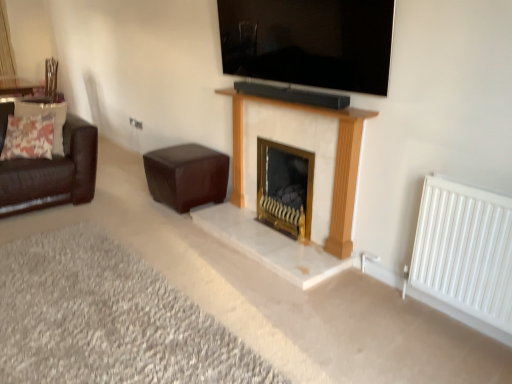
Question: From a real-world perspective, is white fabric curtain at upper left on white metal radiator at right?

Choices:
 (A) no
 (B) yes

Answer: (B)

Question: Does white fabric curtain at upper left have a lesser height compared to white metal radiator at right?

Choices:
 (A) yes
 (B) no

Answer: (B)

Question: Can you confirm if white fabric curtain at upper left is thinner than white metal radiator at right?

Choices:
 (A) yes
 (B) no

Answer: (B)

Question: Does white fabric curtain at upper left touch white metal radiator at right?

Choices:
 (A) no
 (B) yes

Answer: (A)

Question: From the image's perspective, is white fabric curtain at upper left beneath white metal radiator at right?

Choices:
 (A) no
 (B) yes

Answer: (A)

Question: Considering their positions, is white marble fireplace at center located in front of or behind white shaggy carpet at lower left?

Choices:
 (A) front
 (B) behind

Answer: (B)

Question: Is white marble fireplace at center to the left or to the right of white shaggy carpet at lower left in the image?

Choices:
 (A) left
 (B) right

Answer: (B)

Question: Is white marble fireplace at center bigger or smaller than white shaggy carpet at lower left?

Choices:
 (A) big
 (B) small

Answer: (B)

Question: From a real-world perspective, is white marble fireplace at center positioned above or below white shaggy carpet at lower left?

Choices:
 (A) above
 (B) below

Answer: (A)

Question: From the image's perspective, is white metal radiator at right positioned above or below white marble fireplace at center?

Choices:
 (A) above
 (B) below

Answer: (B)

Question: Is point (476, 233) closer or farther from the camera than point (293, 155)?

Choices:
 (A) closer
 (B) farther

Answer: (A)

Question: Based on their sizes in the image, would you say white metal radiator at right is bigger or smaller than white marble fireplace at center?

Choices:
 (A) big
 (B) small

Answer: (B)

Question: Considering the positions of white metal radiator at right and white marble fireplace at center in the image, is white metal radiator at right wider or thinner than white marble fireplace at center?

Choices:
 (A) thin
 (B) wide

Answer: (A)

Question: Is floral fabric pillow at left wider or thinner than black glossy tv at upper center?

Choices:
 (A) wide
 (B) thin

Answer: (A)

Question: Do you think floral fabric pillow at left is within black glossy tv at upper center, or outside of it?

Choices:
 (A) inside
 (B) outside

Answer: (B)